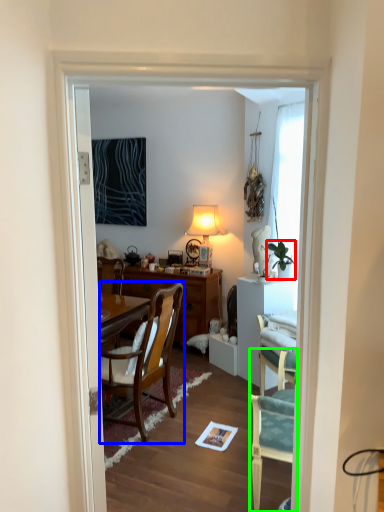
Question: Which is farther away from houseplant (highlighted by a red box)? chair (highlighted by a blue box) or chair (highlighted by a green box)?

Choices:
 (A) chair
 (B) chair

Answer: (B)